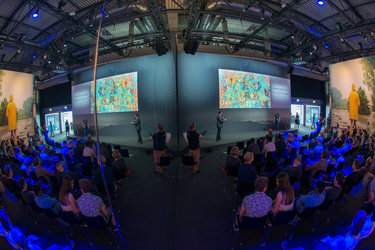
The image size is (375, 250). Find the location of `mirror`. mirror is located at coordinates [130, 112], [45, 170].